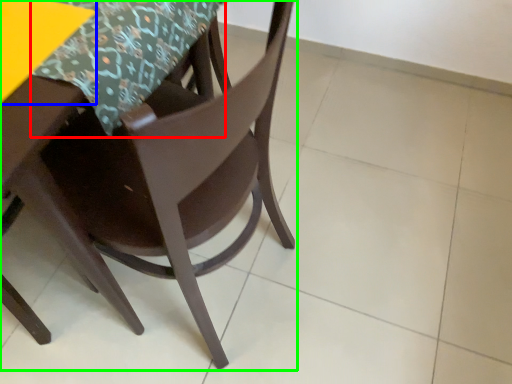
Question: Considering the real-world distances, which object is farthest from tablecloth (highlighted by a red box)? table (highlighted by a blue box) or chair (highlighted by a green box)?

Choices:
 (A) table
 (B) chair

Answer: (B)